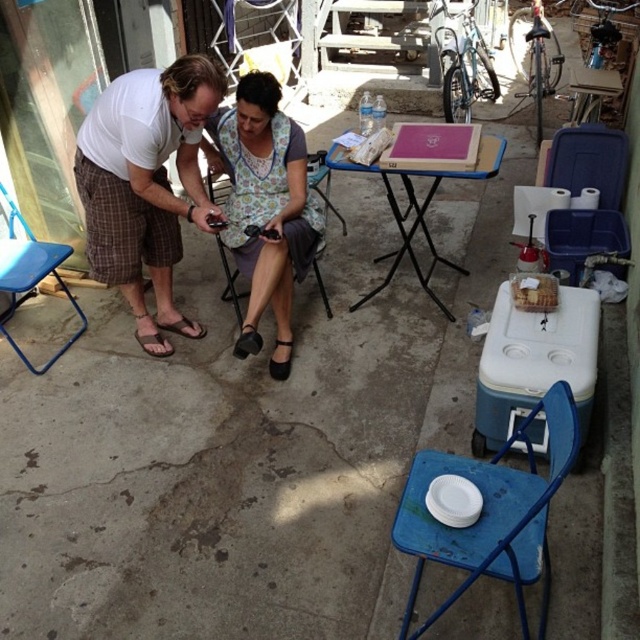
Does black leather sandal at lower center have a lesser height compared to brown leather sandal at lower left?

No, black leather sandal at lower center is not shorter than brown leather sandal at lower left.

Who is more forward, (252,353) or (168,330)?

Point (252,353) is in front.

In order to click on black leather sandal at lower center in this screenshot , I will do `click(248, 342)`.

Find the location of a particular element. The image size is (640, 640). black leather sandal at lower center is located at coordinates [248, 342].

Is blue metal folding chair at lower right smaller than wooden board at center?

Correct, blue metal folding chair at lower right occupies less space than wooden board at center.

Does point (406, 536) come farther from viewer compared to point (420, 209)?

No.

Image resolution: width=640 pixels, height=640 pixels. What are the coordinates of `blue metal folding chair at lower right` in the screenshot? It's located at (490, 513).

Which is above, floral fabric dress at center or wooden board at center?

wooden board at center is higher up.

Is point (266, 234) farther from viewer compared to point (413, 253)?

No, it is not.

Who is more distant from viewer, (291,209) or (364,170)?

Positioned behind is point (364,170).

I want to click on floral fabric dress at center, so click(x=264, y=195).